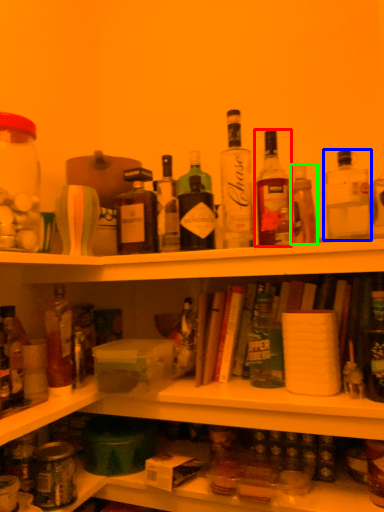
Question: Which object is the farthest from bottle (highlighted by a red box)? Choose among these: bottle (highlighted by a blue box) or bottle (highlighted by a green box).

Choices:
 (A) bottle
 (B) bottle

Answer: (A)